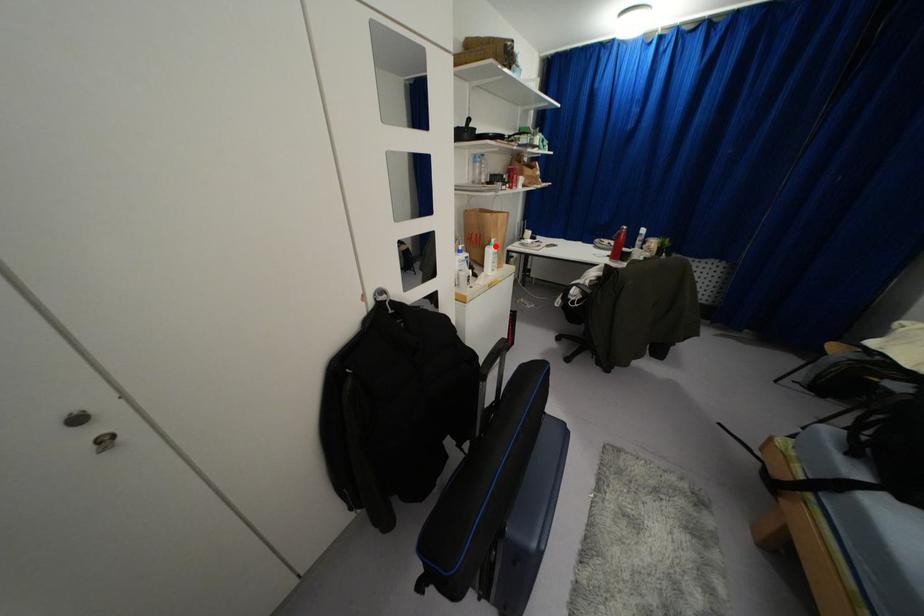
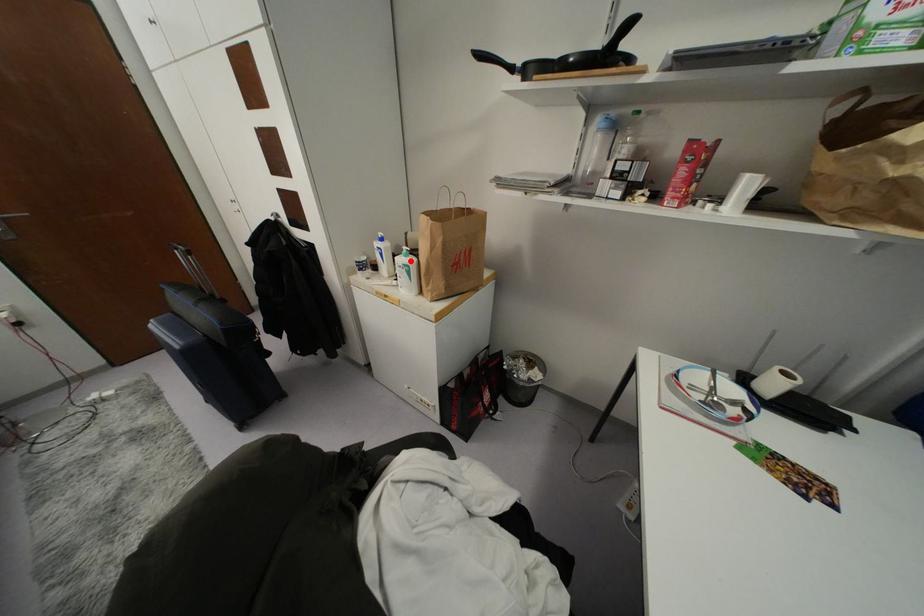
I am providing you with two images of the same scene from different viewpoints. A red point is marked on the first image and another point is marked on the second image. Is the red point in image1 aligned with the point shown in image2?

Yes